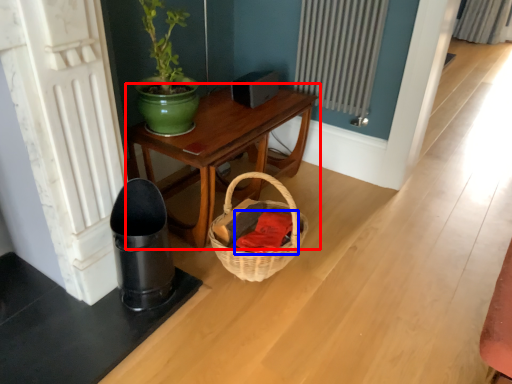
Question: Which object appears closest to the camera in this image, table (highlighted by a red box) or clothing (highlighted by a blue box)?

Choices:
 (A) table
 (B) clothing

Answer: (B)